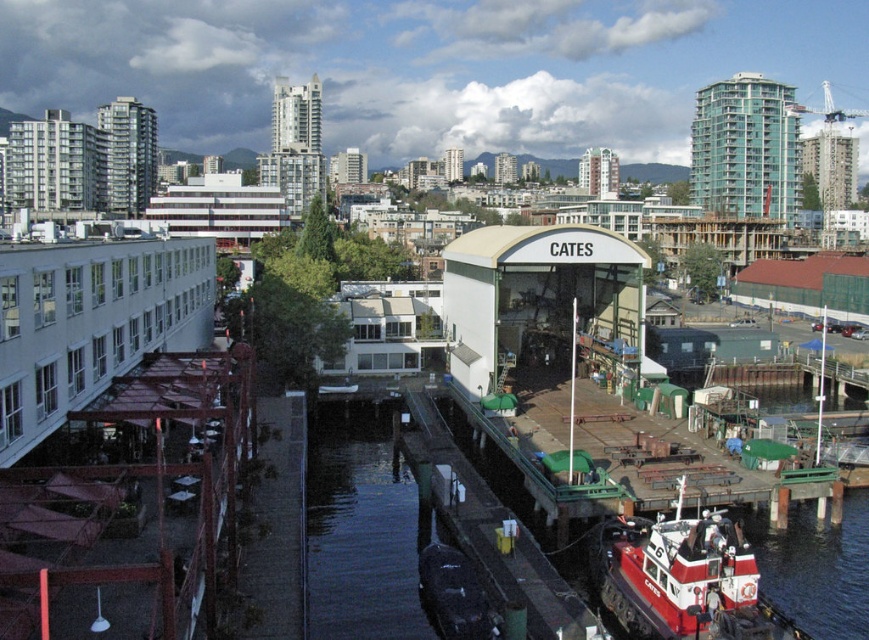
Can you confirm if rustic wood dock at lower left is positioned to the left of green matte dock at lower right?

Indeed, rustic wood dock at lower left is positioned on the left side of green matte dock at lower right.

Does rustic wood dock at lower left have a larger size compared to green matte dock at lower right?

Correct, rustic wood dock at lower left is larger in size than green matte dock at lower right.

Measure the distance between point (121, 486) and camera.

The distance of point (121, 486) from camera is 147.85 feet.

Identify the location of rustic wood dock at lower left. Image resolution: width=869 pixels, height=640 pixels. (131, 504).

Which is in front, point (640, 564) or point (562, 595)?

Point (640, 564) is more forward.

What do you see at coordinates (678, 577) in the screenshot? The height and width of the screenshot is (640, 869). I see `red painted steel tugboat at lower right` at bounding box center [678, 577].

What are the coordinates of `red painted steel tugboat at lower right` in the screenshot? It's located at (678, 577).

Between red painted steel tugboat at lower right and shiny black boat at lower center, which one has less height?

shiny black boat at lower center is shorter.

Can you confirm if red painted steel tugboat at lower right is shorter than shiny black boat at lower center?

In fact, red painted steel tugboat at lower right may be taller than shiny black boat at lower center.

You are a GUI agent. You are given a task and a screenshot of the screen. Output one action in this format:
    pyautogui.click(x=<x>, y=<y>)
    Task: Click on the red painted steel tugboat at lower right
    
    Given the screenshot: What is the action you would take?
    pyautogui.click(x=678, y=577)